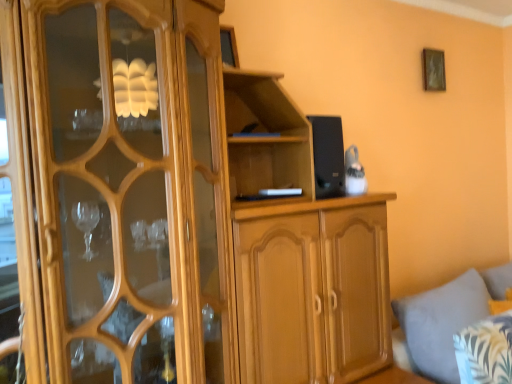
Locate an element on the screen. Image resolution: width=512 pixels, height=384 pixels. wooden picture frame at upper right is located at coordinates (433, 70).

The width and height of the screenshot is (512, 384). Describe the element at coordinates (433, 70) in the screenshot. I see `wooden picture frame at upper right` at that location.

Identify the location of wooden picture frame at upper right. (433, 70).